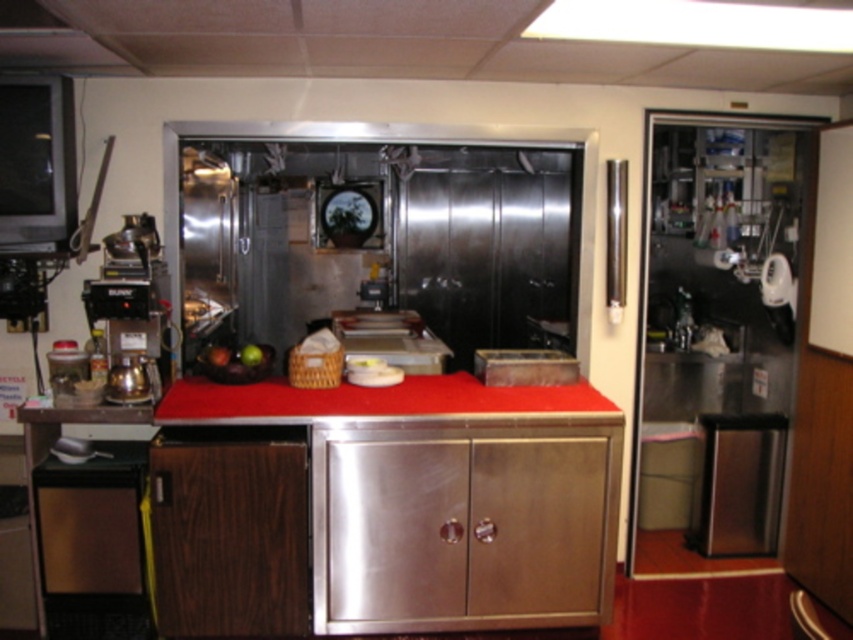
Question: Is satin nickel dishwasher at lower left closer to camera compared to satin silver trash can at lower right?

Choices:
 (A) no
 (B) yes

Answer: (B)

Question: Which of the following is the closest to the observer?

Choices:
 (A) satin nickel dishwasher at lower left
 (B) satin silver trash can at lower right
 (C) red matte counter top at center

Answer: (C)

Question: Estimate the real-world distances between objects in this image. Which object is farther from the satin nickel dishwasher at lower left?

Choices:
 (A) satin silver trash can at lower right
 (B) red matte counter top at center

Answer: (A)

Question: Which of the following is the closest to the observer?

Choices:
 (A) (190, 387)
 (B) (128, 548)
 (C) (753, 488)
 (D) (488, 508)

Answer: (B)

Question: Can you confirm if satin nickel dishwasher at lower left is smaller than satin silver trash can at lower right?

Choices:
 (A) no
 (B) yes

Answer: (A)

Question: Observing the image, what is the correct spatial positioning of stainless steel cabinet at center in reference to satin silver trash can at lower right?

Choices:
 (A) left
 (B) right

Answer: (A)